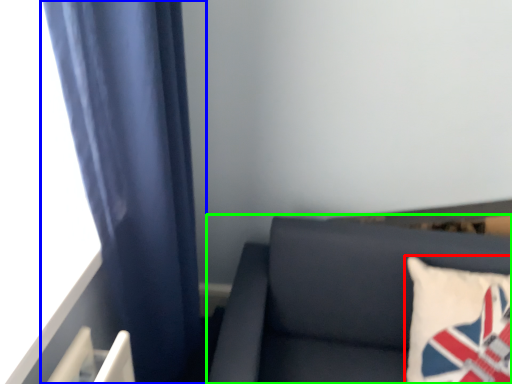
Question: Estimate the real-world distances between objects in this image. Which object is closer to pillow (highlighted by a red box), curtain (highlighted by a blue box) or furniture (highlighted by a green box)?

Choices:
 (A) curtain
 (B) furniture

Answer: (B)